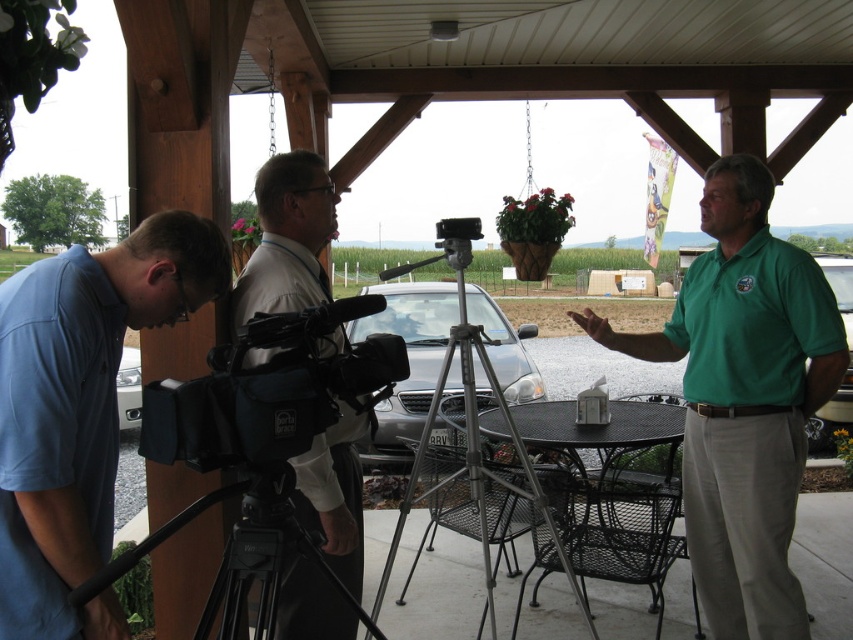
Question: Which of the following is the farthest from the observer?

Choices:
 (A) (303, 634)
 (B) (265, 477)
 (C) (786, 406)

Answer: (C)

Question: Is black fabric video camera at center thinner than black matte tripod at lower left?

Choices:
 (A) no
 (B) yes

Answer: (B)

Question: Is green cotton shirt at center further to camera compared to blue cotton shirt at lower left?

Choices:
 (A) yes
 (B) no

Answer: (A)

Question: Which point is farther from the camera taking this photo?

Choices:
 (A) (218, 609)
 (B) (337, 371)
 (C) (750, 196)
 (D) (44, 413)

Answer: (C)

Question: Can you confirm if green cotton shirt at center is positioned to the right of black matte tripod at lower left?

Choices:
 (A) no
 (B) yes

Answer: (B)

Question: Which point appears closest to the camera in this image?

Choices:
 (A) (743, 419)
 (B) (196, 426)

Answer: (B)